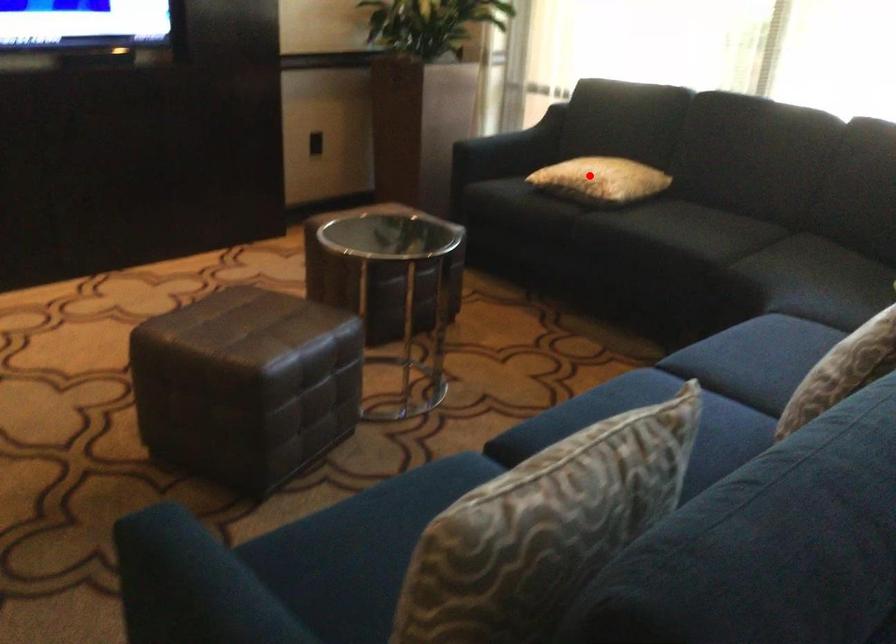
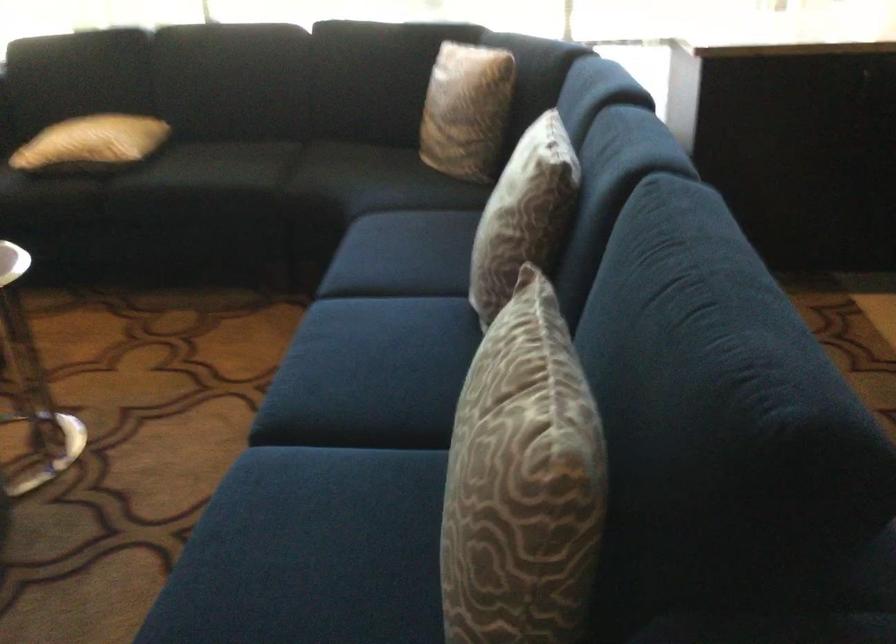
Locate, in the second image, the point that corresponds to the highlighted location in the first image.

(91, 142)